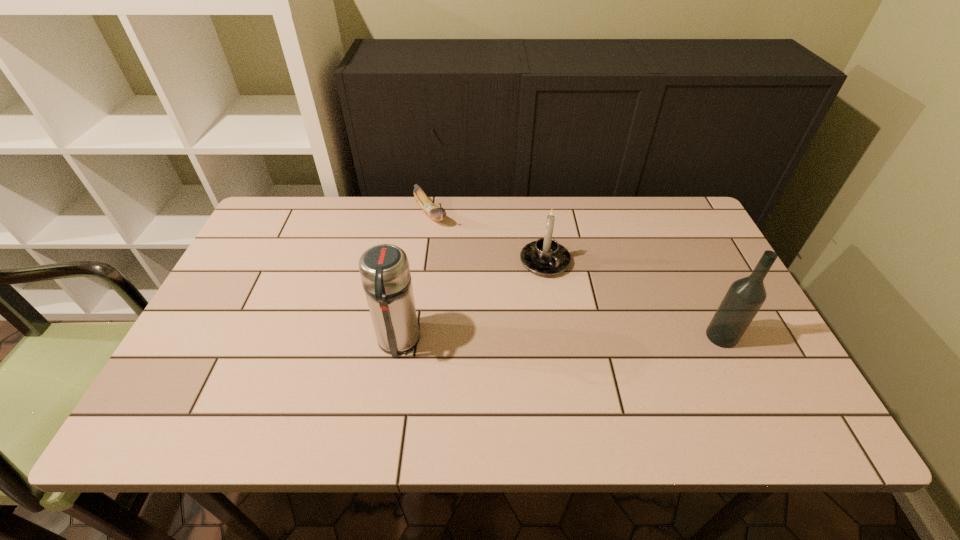
The height and width of the screenshot is (540, 960). I want to click on vacant space on the desktop that is between the thermos bottle and the rightmost object and is positioned at the stem of the shortest object, so click(540, 340).

Locate an element on the screen. The width and height of the screenshot is (960, 540). free space on the desktop that is between the thermos bottle and the rightmost object and is positioned with a handle on the side of the candle holder is located at coordinates [609, 338].